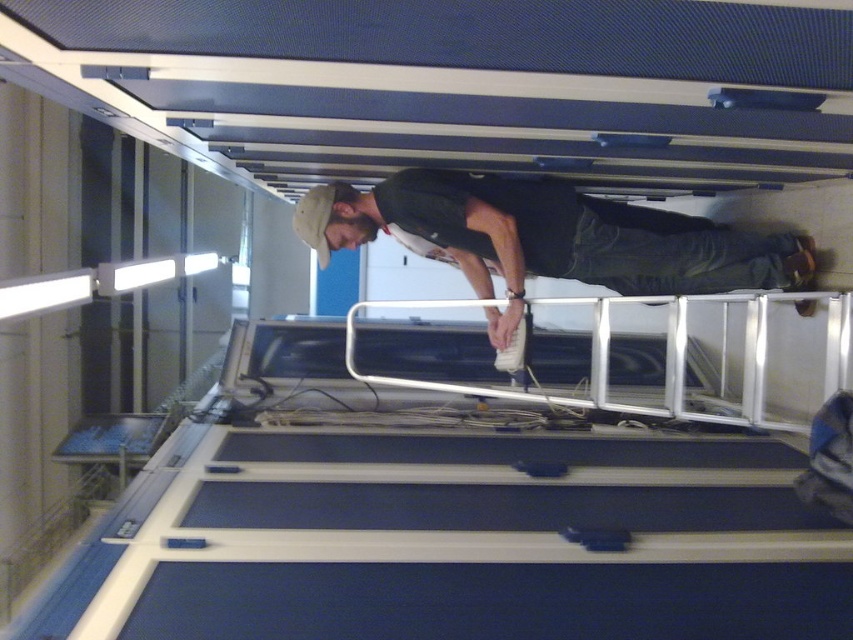
Does dark green fabric shirt at center have a greater height compared to silver metallic rail at center?

Correct, dark green fabric shirt at center is much taller as silver metallic rail at center.

Is point (788, 246) farther from viewer compared to point (622, 404)?

No, it is in front of (622, 404).

Locate an element on the screen. Image resolution: width=853 pixels, height=640 pixels. dark green fabric shirt at center is located at coordinates (550, 237).